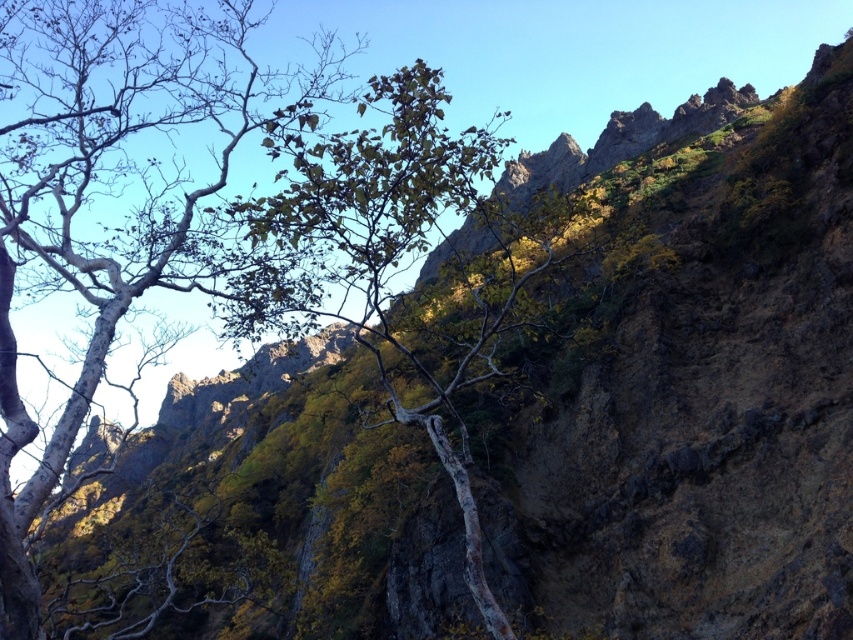
Is smooth bark tree at left bigger than green leafy tree at center?

Correct, smooth bark tree at left is larger in size than green leafy tree at center.

Is smooth bark tree at left below green leafy tree at center?

Actually, smooth bark tree at left is above green leafy tree at center.

Which is behind, point (45, 33) or point (346, 243)?

Positioned behind is point (45, 33).

Where is `smooth bark tree at left`? smooth bark tree at left is located at coordinates (119, 196).